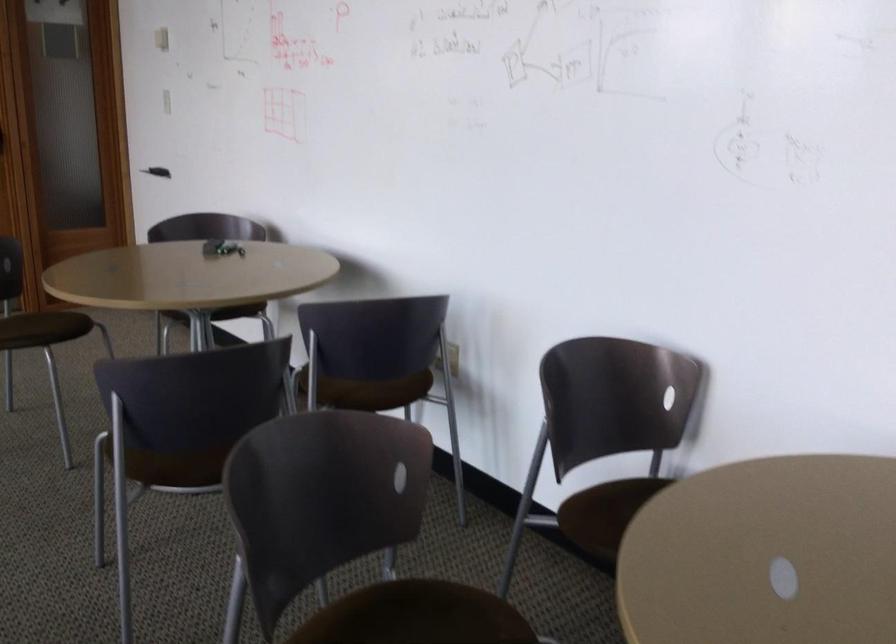
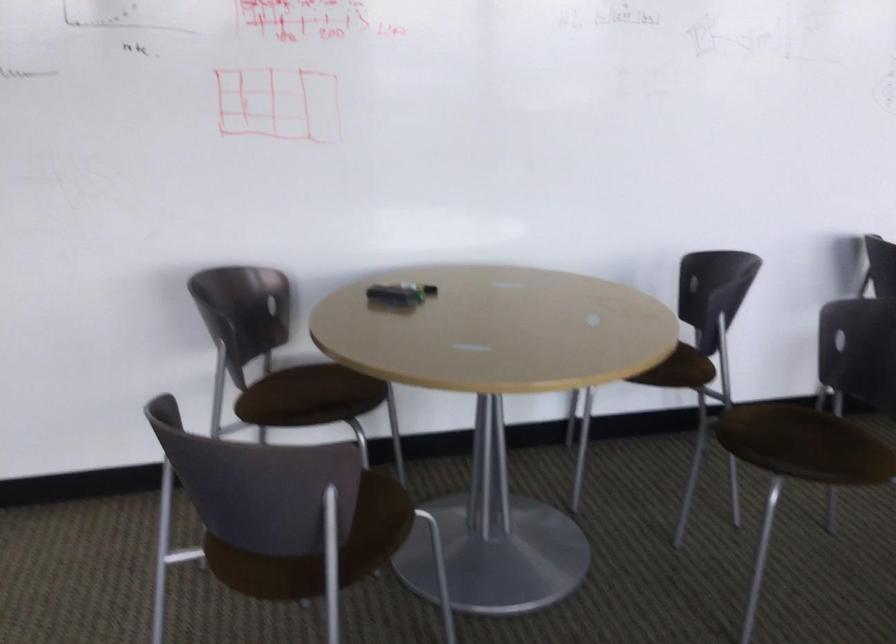
The point at (x=362, y=393) is marked in the first image. Where is the corresponding point in the second image?

(690, 368)